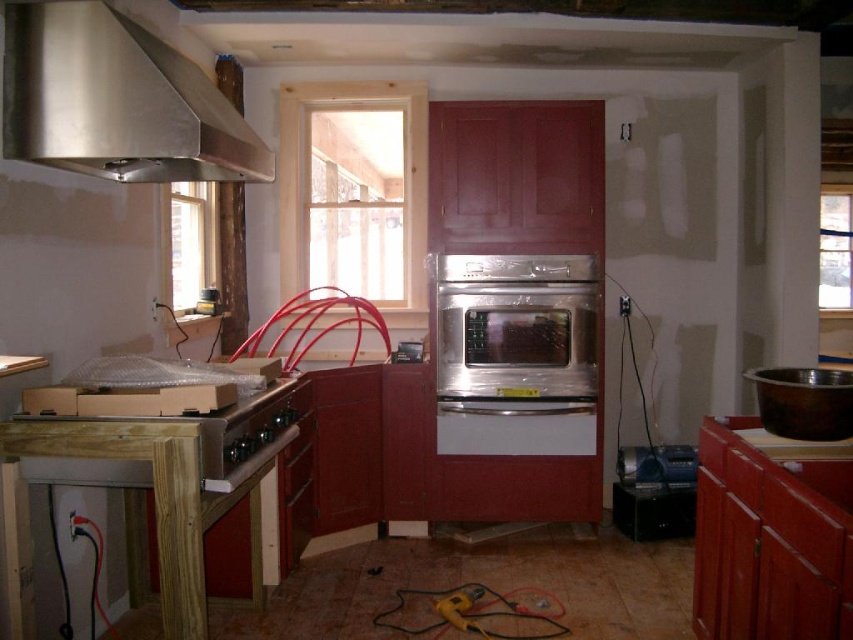
Consider the image. You are a contractor installing a new appliance. The satin stainless steel oven at center requires a space that is at least as wide as itself. You have a spot next to the stainless steel sink at right. Can the oven fit in that space if the sink is already there?

The satin stainless steel oven at center might be wider than stainless steel sink at right, so it may not fit in the space next to the sink if the sink occupies part of the required width.

You are a construction worker carrying a 1.5 meter long pipe. You need to move from the wooden at center to the wooden stove at lower left. Can you move the pipe horizontally without bending it? Please explain your reasoning based on the distance between them.

The distance between the wooden at center and the wooden stove at lower left is 1.51 meters. Since the pipe is 1.5 meters long, it can be moved horizontally between them without bending because the distance is slightly longer than the pipe.